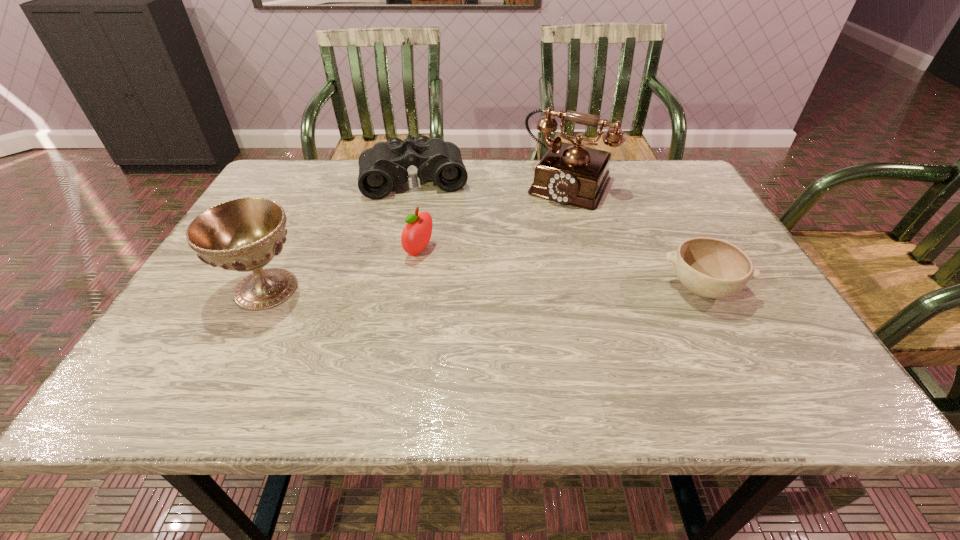
Find the location of a particular element. The image size is (960, 540). free space on the desktop that is between the chalice and the bowl and is positioned at the eyepieces of the binoculars is located at coordinates (431, 288).

Where is `free spot on the desktop that is between the second tallest object and the rightmost object and is positioned on the dial of the telephone`? free spot on the desktop that is between the second tallest object and the rightmost object and is positioned on the dial of the telephone is located at coordinates (501, 288).

The height and width of the screenshot is (540, 960). Find the location of `vacant space on the desktop that is between the fourth shortest object and the rightmost object and is positioned on the front-facing side of the apple`. vacant space on the desktop that is between the fourth shortest object and the rightmost object and is positioned on the front-facing side of the apple is located at coordinates (514, 288).